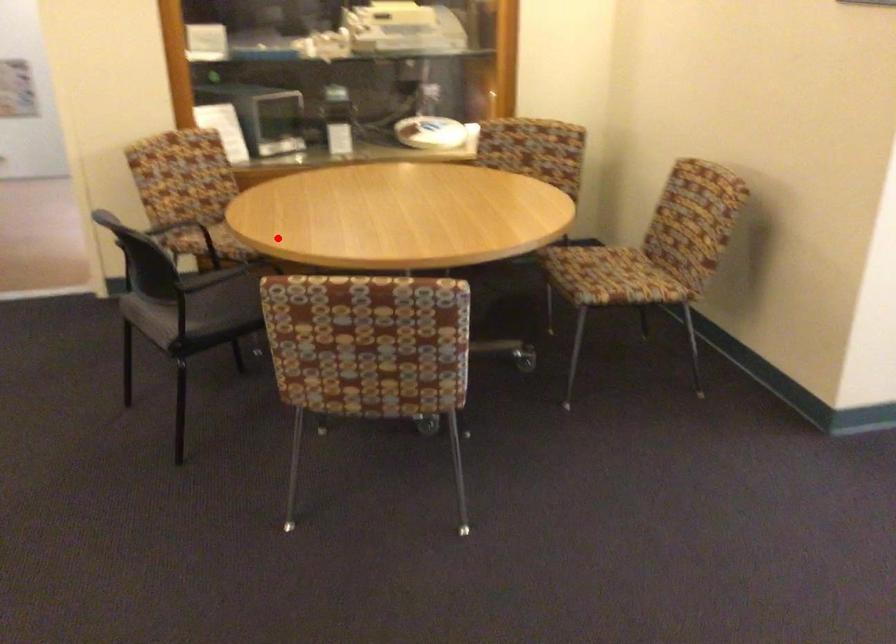
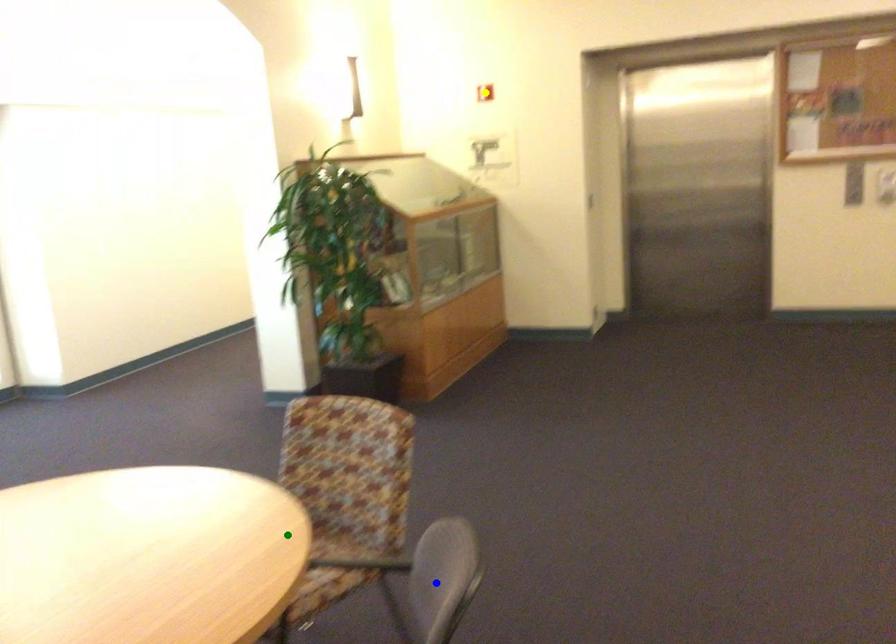
Question: I am providing you with two images of the same scene from different viewpoints. A red point is marked on the first image. You are given multiple points on the second image. In image 2, which mark is for the same physical point as the one in image 1?

Choices:
 (A) blue point
 (B) green point
 (C) yellow point

Answer: (B)